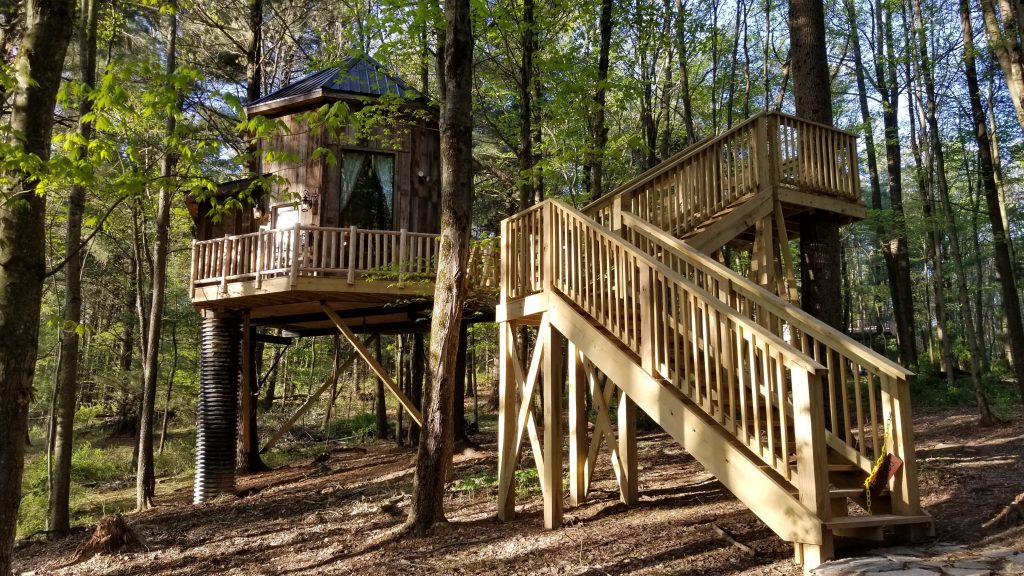
Image resolution: width=1024 pixels, height=576 pixels. I want to click on window, so click(x=364, y=195).